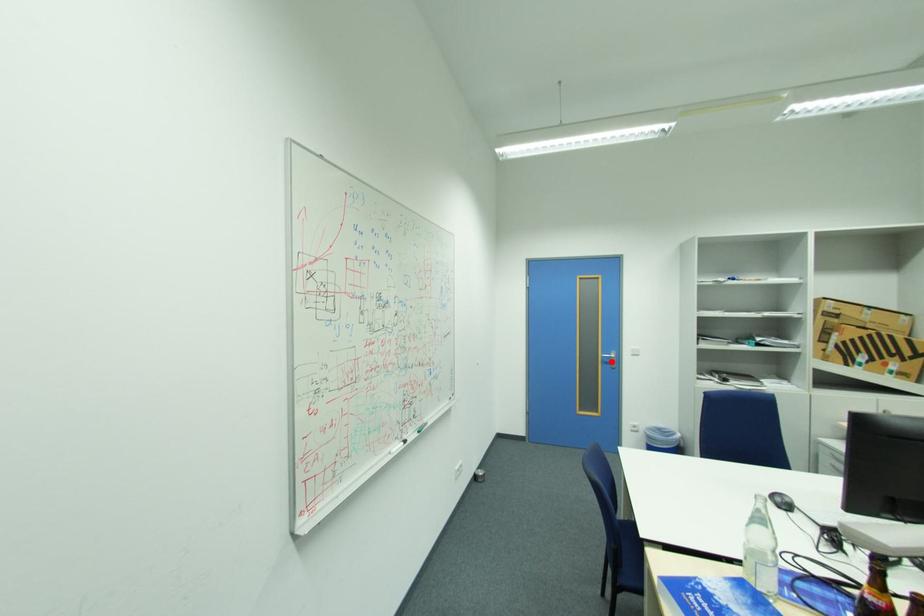
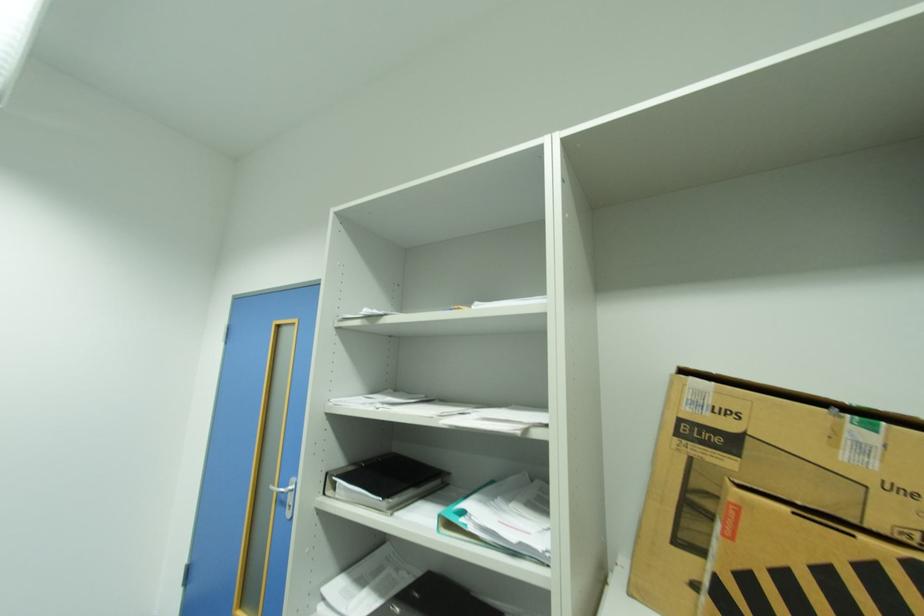
Find the pixel in the second image that matches the highlighted location in the first image.

(287, 498)